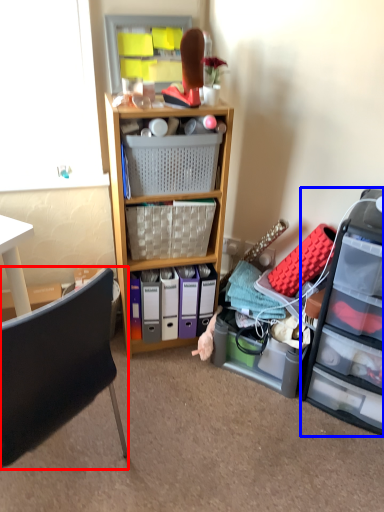
Question: Which object is further to the camera taking this photo, chair (highlighted by a red box) or file cabinet (highlighted by a blue box)?

Choices:
 (A) chair
 (B) file cabinet

Answer: (B)